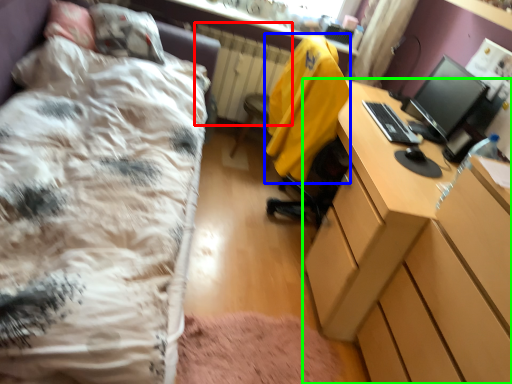
Question: Which object is the farthest from radiator (highlighted by a red box)? Choose among these: jacket (highlighted by a blue box) or desk (highlighted by a green box).

Choices:
 (A) jacket
 (B) desk

Answer: (B)